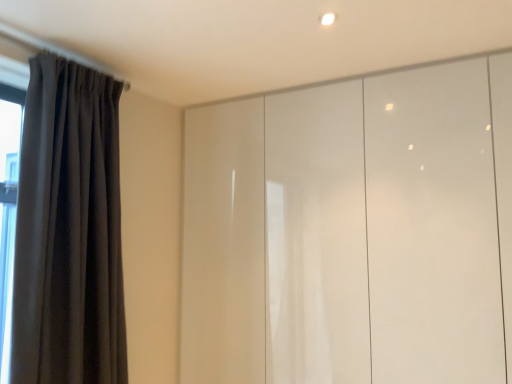
Question: Visually, is dark grey velvet curtain at left positioned to the left or to the right of glossy white cupboard at center?

Choices:
 (A) right
 (B) left

Answer: (B)

Question: In terms of width, does dark grey velvet curtain at left look wider or thinner when compared to glossy white cupboard at center?

Choices:
 (A) wide
 (B) thin

Answer: (B)

Question: From the image's perspective, relative to glossy white cupboard at center, is dark grey velvet curtain at left above or below?

Choices:
 (A) below
 (B) above

Answer: (B)

Question: Considering the positions of point (394, 218) and point (69, 329), is point (394, 218) closer or farther from the camera than point (69, 329)?

Choices:
 (A) closer
 (B) farther

Answer: (B)

Question: From a real-world perspective, relative to dark grey velvet curtain at left, is glossy white cupboard at center vertically above or below?

Choices:
 (A) above
 (B) below

Answer: (B)

Question: From the image's perspective, is glossy white cupboard at center located above or below dark grey velvet curtain at left?

Choices:
 (A) below
 (B) above

Answer: (A)

Question: Is glossy white cupboard at center spatially inside dark grey velvet curtain at left, or outside of it?

Choices:
 (A) outside
 (B) inside

Answer: (A)